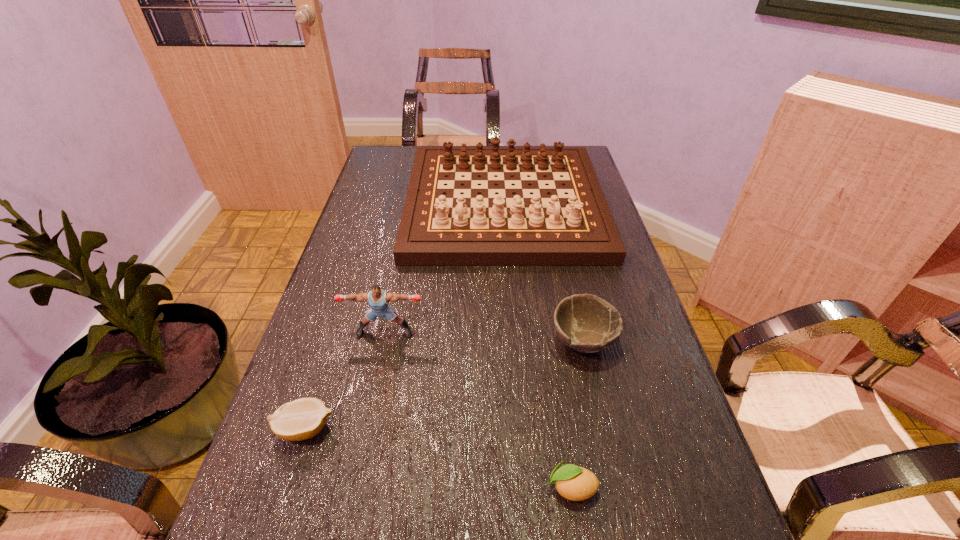
In order to click on free location located 0.280m with leaves positioned above the nearest object in this screenshot , I will do [x=376, y=488].

Identify the location of free spot located with leaves positioned above the nearest object. Image resolution: width=960 pixels, height=540 pixels. (395, 488).

Identify the location of vacant space situated with leaves positioned above the nearest object. The height and width of the screenshot is (540, 960). (509, 488).

Image resolution: width=960 pixels, height=540 pixels. In order to click on free space located 0.390m on the right of the farther lemon in this screenshot , I will do `click(548, 429)`.

What are the coordinates of `object located at the far edge` in the screenshot? It's located at (563, 219).

Find the location of `gameboard at the left edge`. gameboard at the left edge is located at coordinates (563, 219).

Image resolution: width=960 pixels, height=540 pixels. What are the coordinates of `puncher that is at the left edge` in the screenshot? It's located at (378, 299).

Locate an element on the screen. lemon positioned at the left edge is located at coordinates click(301, 419).

The image size is (960, 540). What are the coordinates of `gameboard positioned at the right edge` in the screenshot? It's located at (563, 219).

Locate an element on the screen. The image size is (960, 540). bowl located at the right edge is located at coordinates (586, 323).